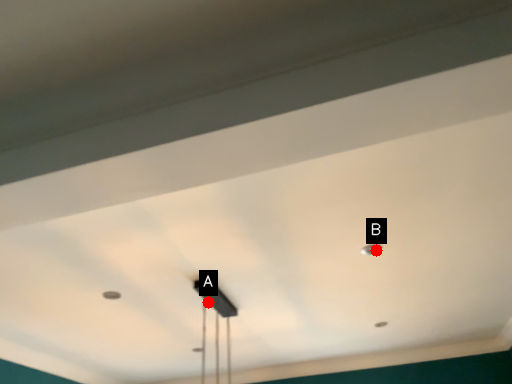
Question: Two points are circled on the image, labeled by A and B beside each circle. Which of the following is the closest to the observer?

Choices:
 (A) A is closer
 (B) B is closer

Answer: (B)